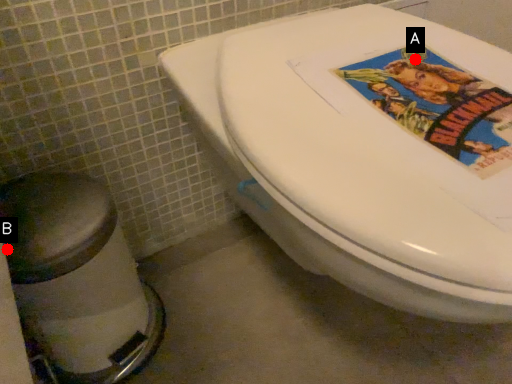
Question: Two points are circled on the image, labeled by A and B beside each circle. Which of the following is the closest to the observer?

Choices:
 (A) A is closer
 (B) B is closer

Answer: (B)